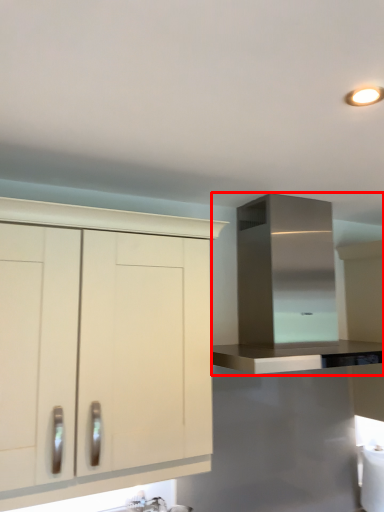
Question: From the image's perspective, where is cabinetry (annotated by the red box) located relative to cabinetry?

Choices:
 (A) above
 (B) below

Answer: (A)